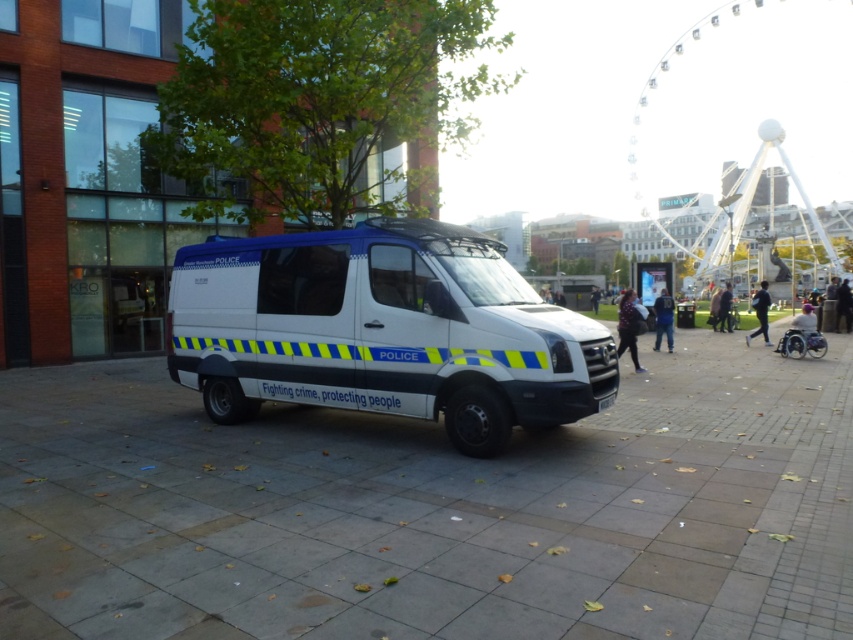
You are a detective examining the scene and notice two items at the center of the image. Which item is positioned to the left when looking at the blue jeans at center and the dark brown leather jacket at center?

The blue jeans at center are positioned to the left of the dark brown leather jacket at center.